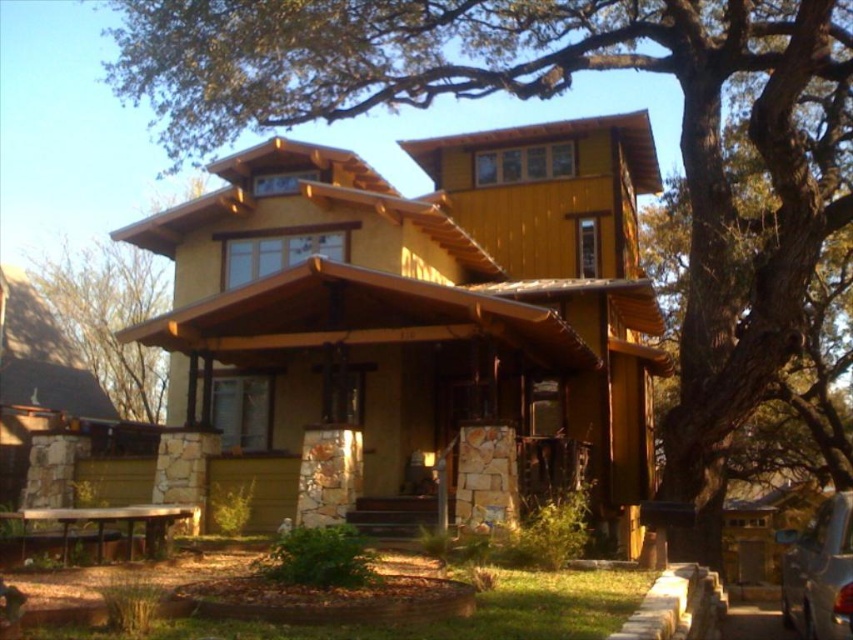
Question: Is green leafy tree at left positioned in front of metallic silver car at lower right?

Choices:
 (A) no
 (B) yes

Answer: (A)

Question: Which object appears farthest from the camera in this image?

Choices:
 (A) metallic silver car at lower right
 (B) green leafy tree at left

Answer: (B)

Question: In this image, where is green leafy tree at left located relative to metallic silver car at lower right?

Choices:
 (A) left
 (B) right

Answer: (A)

Question: Which object is farther from the camera taking this photo?

Choices:
 (A) green leafy tree at left
 (B) metallic silver car at lower right

Answer: (A)

Question: Can you confirm if green leafy tree at left is positioned to the right of metallic silver car at lower right?

Choices:
 (A) no
 (B) yes

Answer: (A)